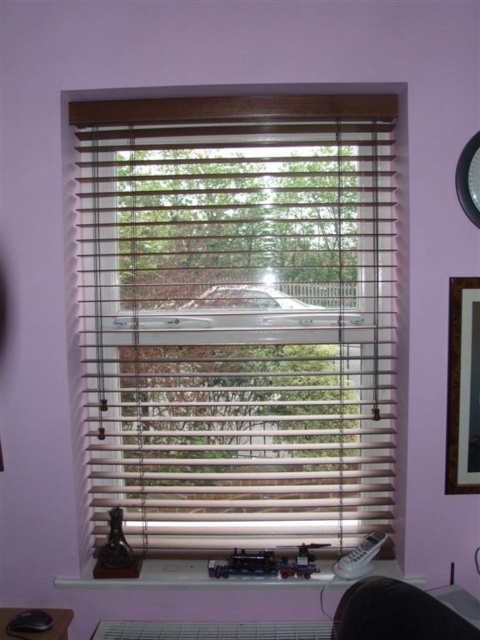
You are standing in front of the window with horizontal blinds and want to determine which of the two points, point (474,184) or point (44,632), is closer to you. Based on the scene description, which point is nearer to your position?

Point (44,632) is closer to you because it is positioned closer to the camera than point (474,184), which is further away.

Consider the image. You are a delivery person who needs to place a small package between the metallic clock at upper right and the black plastic mouse at lower left. The package requires at least 3 feet of space to fit. Can you fit it there?

The metallic clock at upper right is 4.30 feet from the black plastic mouse at lower left, so yes, the package can fit between them since the distance is more than the required 3 feet.

You are standing in front of the window with horizontal blinds. You notice two points marked on the window frame. Which point, point (273, 449) or point (459, 305), is closer to you?

Point (273, 449) is closer to you because it is further to the viewer than point (459, 305).